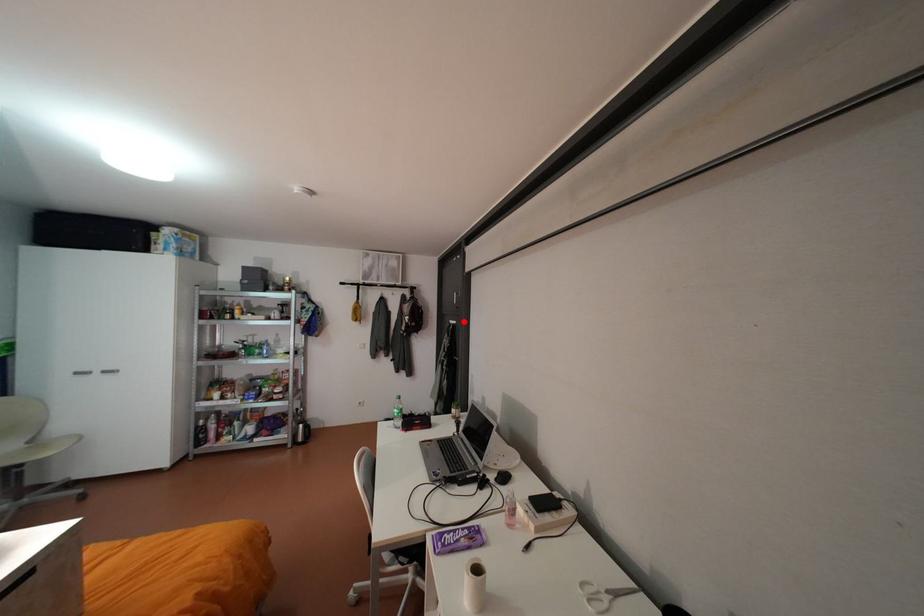
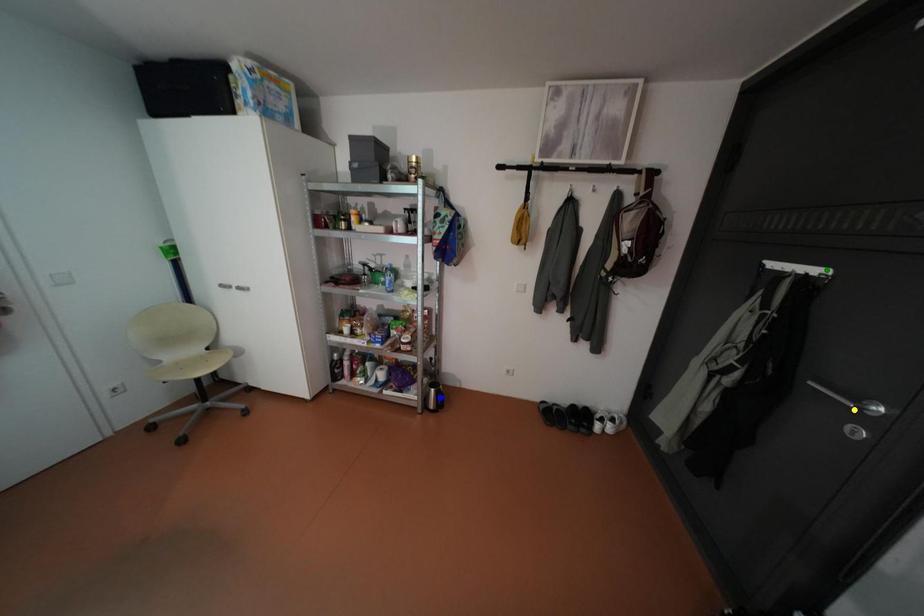
Question: I am providing you with two images of the same scene from different viewpoints. A red point is marked on the first image. You are given multiple points on the second image. In image 2, which mark is for the same physical point as the one in image 1?

Choices:
 (A) yellow point
 (B) green point
 (C) blue point

Answer: (B)